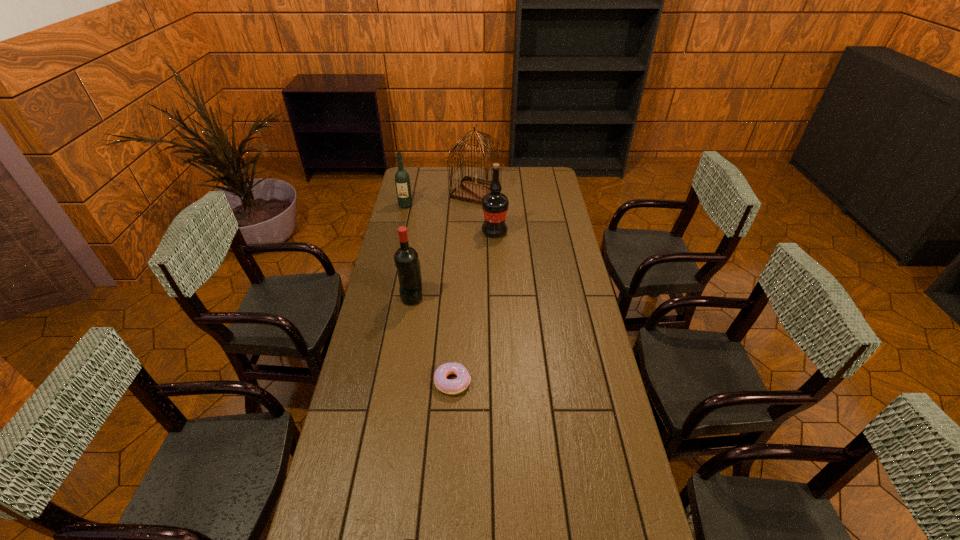
The height and width of the screenshot is (540, 960). What are the coordinates of `vacant space that's between the second object from left to right and the rightmost wine bottle` in the screenshot? It's located at (453, 264).

Where is `vacant space that's between the birdcage and the shortest object`? vacant space that's between the birdcage and the shortest object is located at coordinates (464, 287).

Where is `unoccupied area between the third shortest object and the birdcage`? The width and height of the screenshot is (960, 540). unoccupied area between the third shortest object and the birdcage is located at coordinates (441, 199).

The height and width of the screenshot is (540, 960). Identify the location of the third closest object to the doughnut. (495, 205).

Locate an element on the screen. This screenshot has height=540, width=960. object that stands as the fifth closest to the third nearest object is located at coordinates (403, 539).

The height and width of the screenshot is (540, 960). Identify the location of wine bottle object that ranks as the third closest to the birdcage. (406, 259).

Point out which wine bottle is positioned as the third nearest to the birdcage. Please provide its 2D coordinates. Your answer should be formatted as a tuple, i.e. [(x, y)], where the tuple contains the x and y coordinates of a point satisfying the conditions above.

[(406, 259)]

You are a GUI agent. You are given a task and a screenshot of the screen. Output one action in this format:
    pyautogui.click(x=<x>, y=<y>)
    Task: Click on the vacant area that satisfies the following two spatial constraints: 1. on the labeled side of the fourth tallest object; 2. on the left side of the second object from left to right
    This screenshot has width=960, height=540.
    Given the screenshot: What is the action you would take?
    pyautogui.click(x=385, y=296)

Locate an element on the screen. The height and width of the screenshot is (540, 960). blank area in the image that satisfies the following two spatial constraints: 1. on the back side of the shortest object; 2. on the right side of the birdcage is located at coordinates (463, 192).

Where is `blank area in the image that satisfies the following two spatial constraints: 1. on the back side of the birdcage; 2. on the right side of the fourth farthest object`? The height and width of the screenshot is (540, 960). blank area in the image that satisfies the following two spatial constraints: 1. on the back side of the birdcage; 2. on the right side of the fourth farthest object is located at coordinates (429, 192).